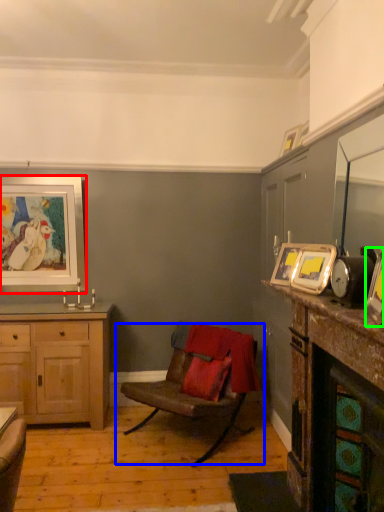
Question: Estimate the real-world distances between objects in this image. Which object is closer to picture frame (highlighted by a red box), chair (highlighted by a blue box) or picture frame (highlighted by a green box)?

Choices:
 (A) chair
 (B) picture frame

Answer: (A)